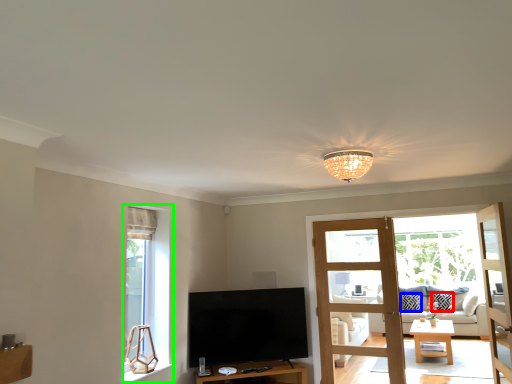
Question: Estimate the real-world distances between objects in this image. Which object is closer to pillow (highlighted by a red box), pillow (highlighted by a blue box) or window (highlighted by a green box)?

Choices:
 (A) pillow
 (B) window

Answer: (A)